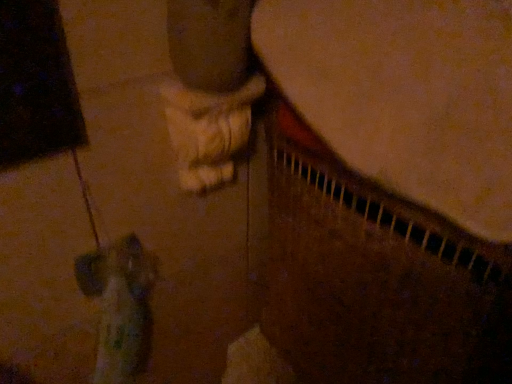
What do you see at coordinates (119, 306) in the screenshot?
I see `shiny plastic shoe at lower left` at bounding box center [119, 306].

This screenshot has height=384, width=512. In order to click on shiny plastic shoe at lower left in this screenshot , I will do `click(119, 306)`.

At what (x,y) coordinates should I click in order to perform the action: click on shiny plastic shoe at lower left. Please return your answer as a coordinate pair (x, y). This screenshot has height=384, width=512. Looking at the image, I should click on (119, 306).